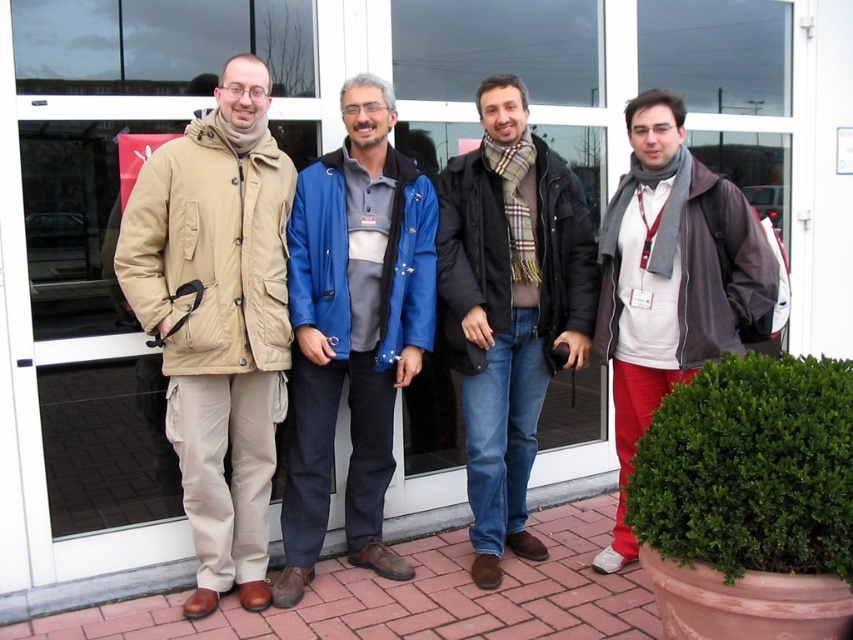
Which of these two, beige fabric coat at left or blue fabric jacket at center, stands shorter?

With less height is blue fabric jacket at center.

Is point (173, 154) positioned in front of point (392, 316)?

Yes, point (173, 154) is closer to viewer.

Describe the element at coordinates (218, 320) in the screenshot. I see `beige fabric coat at left` at that location.

This screenshot has height=640, width=853. I want to click on beige fabric coat at left, so click(218, 320).

Does blue fabric jacket at center have a lesser height compared to gray wool scarf at right?

In fact, blue fabric jacket at center may be taller than gray wool scarf at right.

Is point (366, 385) farther from viewer compared to point (718, 314)?

Yes.

Locate an element on the screen. Image resolution: width=853 pixels, height=640 pixels. blue fabric jacket at center is located at coordinates (352, 330).

Between point (296, 413) and point (538, 340), which one is positioned behind?

The point (538, 340) is behind.

Does blue fabric jacket at center have a larger size compared to plaid scarf at center?

Incorrect, blue fabric jacket at center is not larger than plaid scarf at center.

Where is `blue fabric jacket at center`? The image size is (853, 640). blue fabric jacket at center is located at coordinates (352, 330).